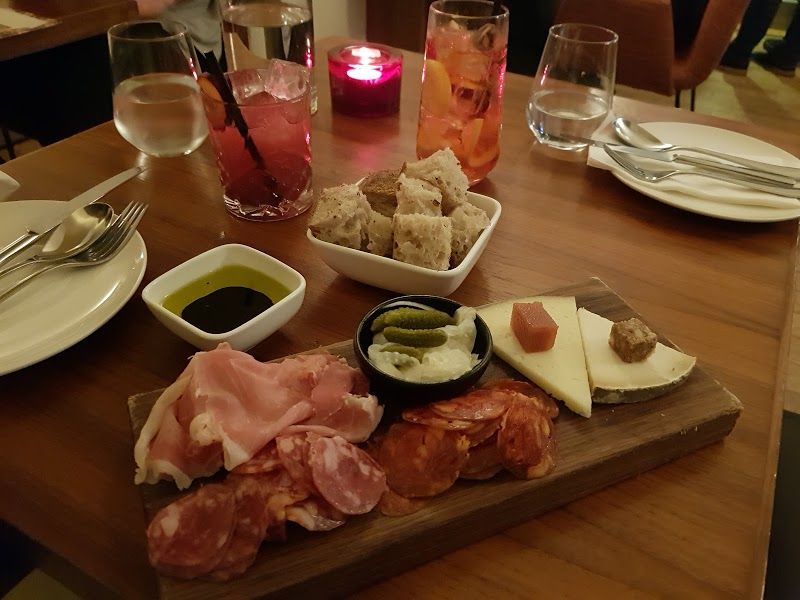
In order to click on tealight candle in this screenshot , I will do `click(360, 71)`.